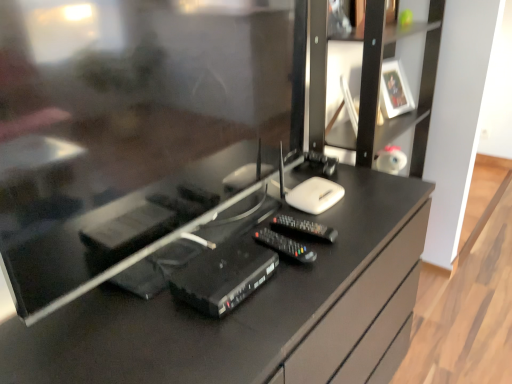
Question: Considering the relative positions of white glossy picture frame at upper right and black plastic remote at center in the image provided, is white glossy picture frame at upper right to the left or to the right of black plastic remote at center?

Choices:
 (A) left
 (B) right

Answer: (B)

Question: From a real-world perspective, is white glossy picture frame at upper right positioned above or below black plastic remote at center?

Choices:
 (A) above
 (B) below

Answer: (A)

Question: Which is nearer to the black plastic remote control at center, acting as the 1th equipment starting from the right?

Choices:
 (A) white glossy picture frame at upper right
 (B) black matte tv cabinet at right
 (C) black glossy desk at center
 (D) black plastic router at center, placed as the 2th equipment when sorted from right to left
 (E) black plastic remote at center

Answer: (E)

Question: Which is farther from the white glossy picture frame at upper right?

Choices:
 (A) black plastic remote at center
 (B) black plastic remote control at center, acting as the 1th equipment starting from the right
 (C) black glossy desk at center
 (D) black plastic router at center, placed as the 2th equipment when sorted from right to left
 (E) black matte tv cabinet at right

Answer: (D)